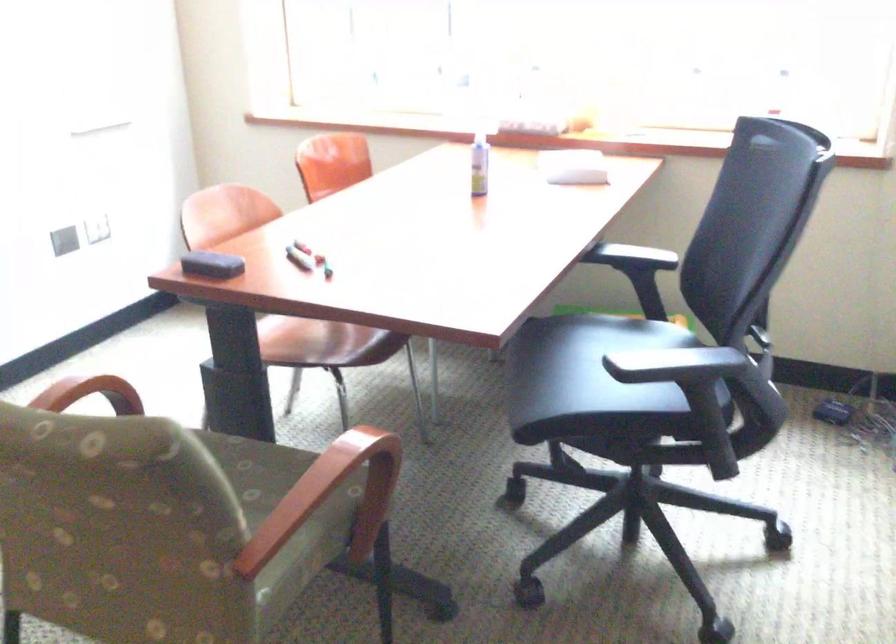
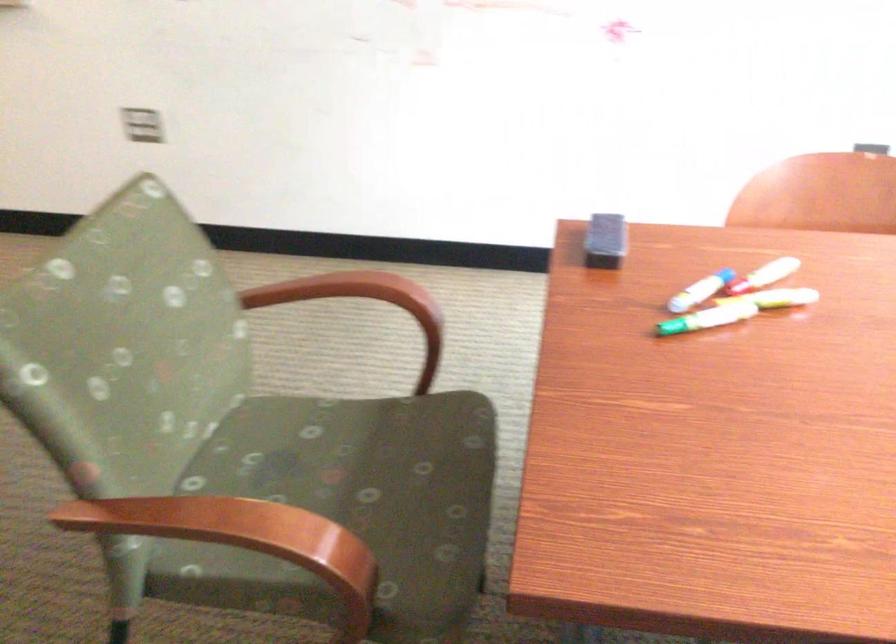
Where in the second image is the point corresponding to the point at 338,453 from the first image?

(234, 527)